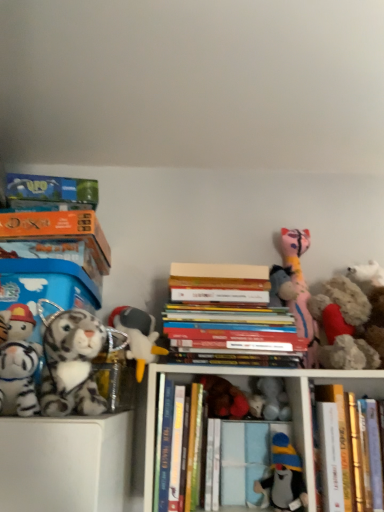
Question: Looking at the image, does hardcover books at center, which appears as the third book when viewed from the left, seem bigger or smaller compared to hardcover books at center?

Choices:
 (A) big
 (B) small

Answer: (B)

Question: Considering the positions of hardcover books at center, which ranks as the 2th book in right-to-left order, and hardcover books at center in the image, is hardcover books at center, which ranks as the 2th book in right-to-left order, taller or shorter than hardcover books at center?

Choices:
 (A) short
 (B) tall

Answer: (A)

Question: Which object is positioned farthest from the soft plush penguin at center, which is the 4th toy in right-to-left order?

Choices:
 (A) orange cardboard book at left, which is the first book in left-to-right order
 (B) white plush toy at center, the 5th toy in the left-to-right sequence
 (C) fluffy white teddy bear at right, the 1th toy when ordered from right to left
 (D) hardcover books at center, which ranks as the 2th book in right-to-left order
 (E) hardcover book at center, positioned as the first book in right-to-left order

Answer: (A)

Question: Which object is positioned closest to the hardcover book at center, the 2th book viewed from the left?

Choices:
 (A) fluffy beige stuffed animal at right, acting as the 2th toy starting from the right
 (B) white plush toy at center-left, the 3th toy when ordered from left to right
 (C) hardcover book at center, which is counted as the fourth book, starting from the left
 (D) hardcover books at center
 (E) hardcover books at center, which appears as the third book when viewed from the left

Answer: (D)